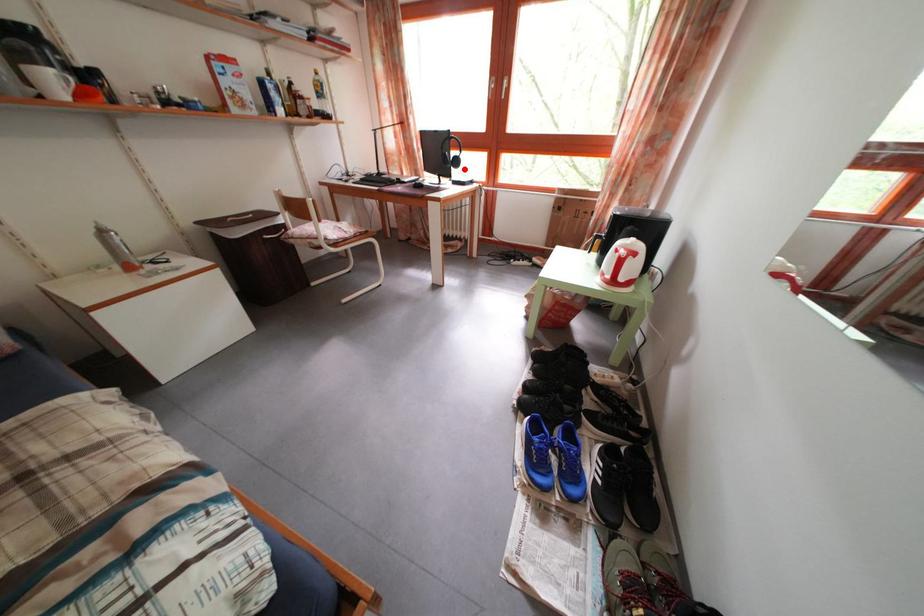
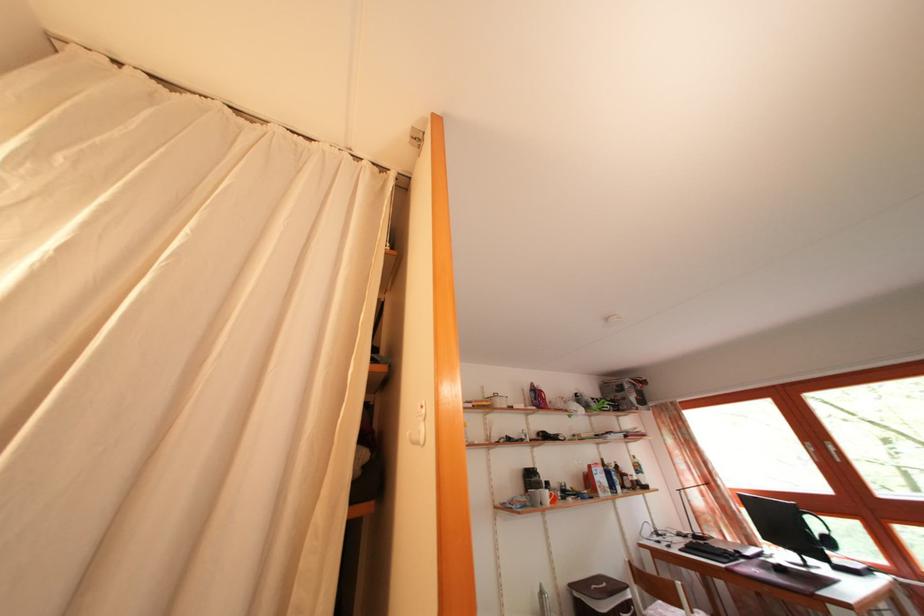
Locate, in the second image, the point that corresponds to the highlighted location in the first image.

(837, 549)